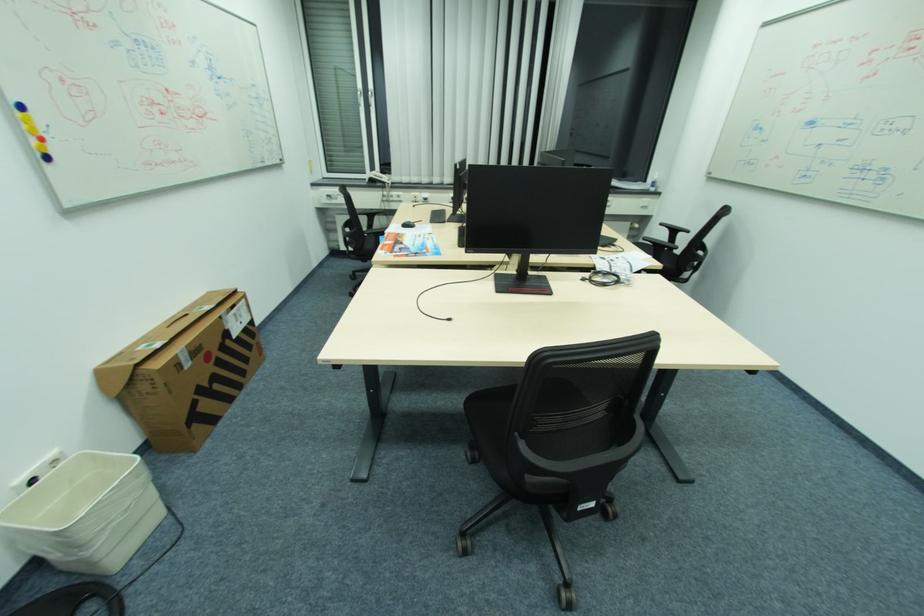
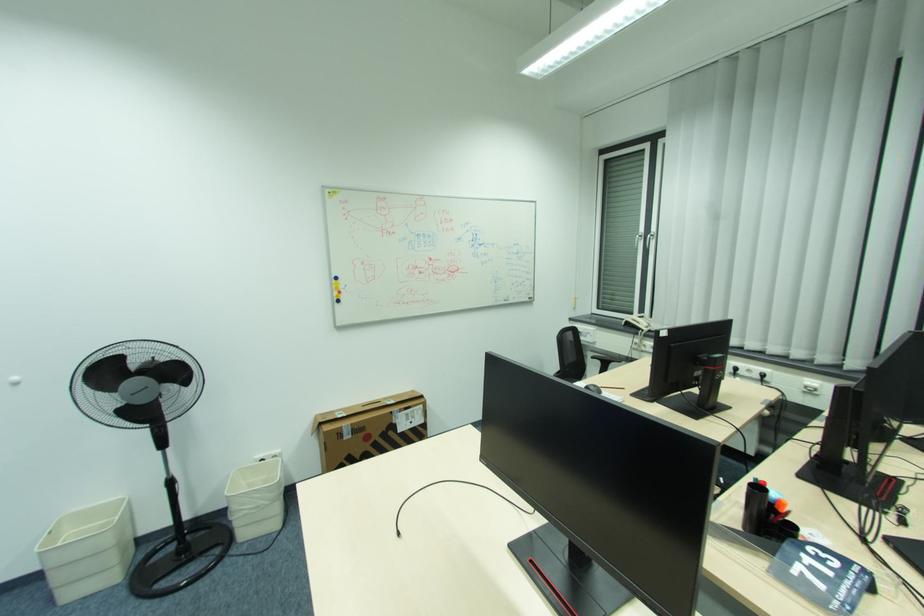
In the second image, find the point that corresponds to (x=363, y=215) in the first image.

(599, 358)